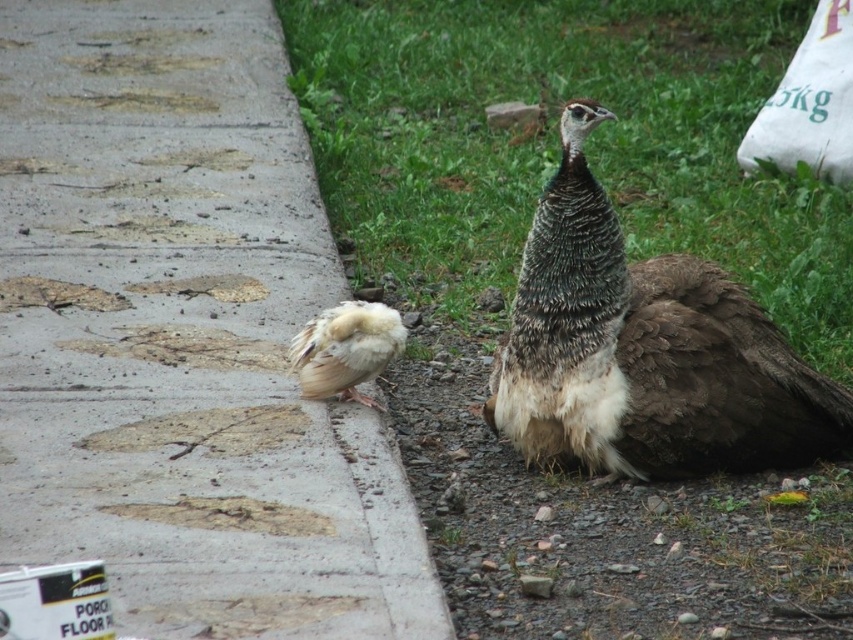
You are a photographer trying to capture both the brown feathered peacock at lower right and the white fluffy feather at left in the same frame. Based on their positions, which bird should you adjust your camera angle to focus on first to ensure both are in the shot?

The white fluffy feather at left should be focused on first since the brown feathered peacock at lower right is to the right of it, meaning adjusting the angle towards the left will help include both in the frame.

Consider the image. You are standing at the point marked by the coordinate point (630,257) in the image. Looking around, you see a large adult peacock and a smaller bird chick. Which direction should you walk to reach the green grass at upper center?

The point (630,257) already marks the location of the green grass at upper center, so you are already standing on it.

Based on the photo, you are a bird enthusiast observing the scene. You notice the green grass at upper center and the white fluffy feather at left. Which object is positioned to the right of the other?

The green grass at upper center is to the right of the white fluffy feather at left.